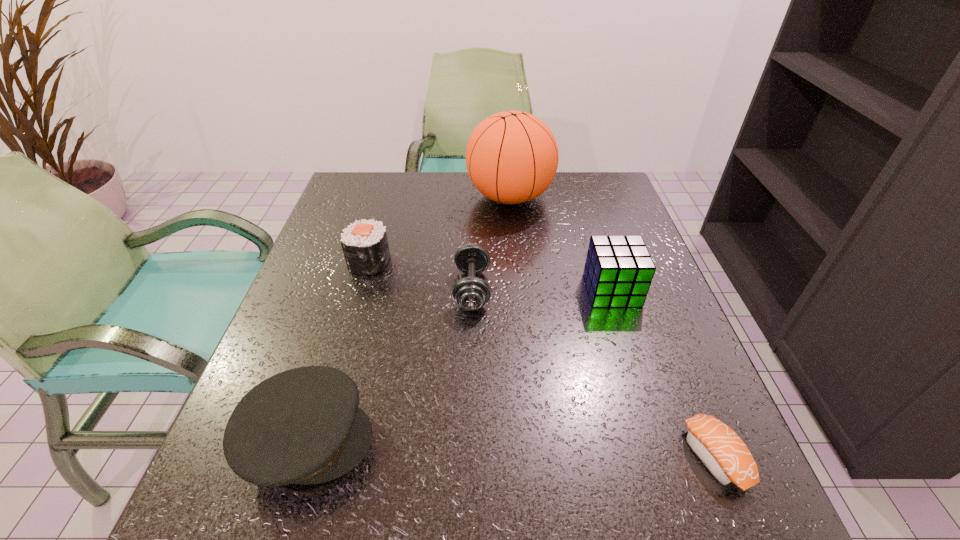
You are a GUI agent. You are given a task and a screenshot of the screen. Output one action in this format:
    pyautogui.click(x=<x>, y=<y>)
    Task: Click on the cube that is at the right edge
    
    Given the screenshot: What is the action you would take?
    pyautogui.click(x=618, y=271)

Locate an element on the screen. sushi that is positioned at the right edge is located at coordinates (720, 449).

Identify the location of object located at the near left corner. (303, 426).

Where is `object located at the near right corner`? object located at the near right corner is located at coordinates (720, 449).

Locate an element on the screen. The width and height of the screenshot is (960, 540). vacant point at the near edge is located at coordinates (428, 496).

In the image, there is a desktop. Identify the location of free region at the left edge. (324, 228).

Locate an element on the screen. free point at the right edge is located at coordinates (627, 232).

You are a GUI agent. You are given a task and a screenshot of the screen. Output one action in this format:
    pyautogui.click(x=<x>, y=<y>)
    Task: Click on the vacant area at the far left corner of the desktop
    
    Given the screenshot: What is the action you would take?
    pyautogui.click(x=368, y=202)

Find the location of a particular element. vacant space at the far right corner of the desktop is located at coordinates (601, 172).

The width and height of the screenshot is (960, 540). In order to click on free space between the taller sushi and the tallest object in this screenshot , I will do `click(440, 230)`.